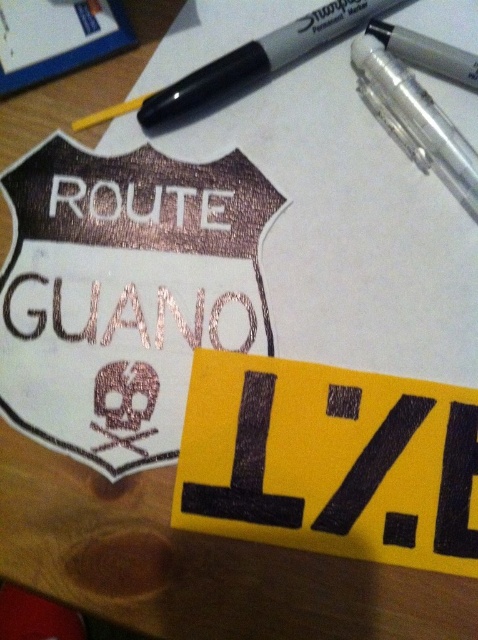
You are organizing a desk and see the rose gold metallic sign at upper center and the clear plastic pen at upper right. Which object is positioned lower on the desk?

The rose gold metallic sign at upper center is located below the clear plastic pen at upper right, so it is positioned lower on the desk.